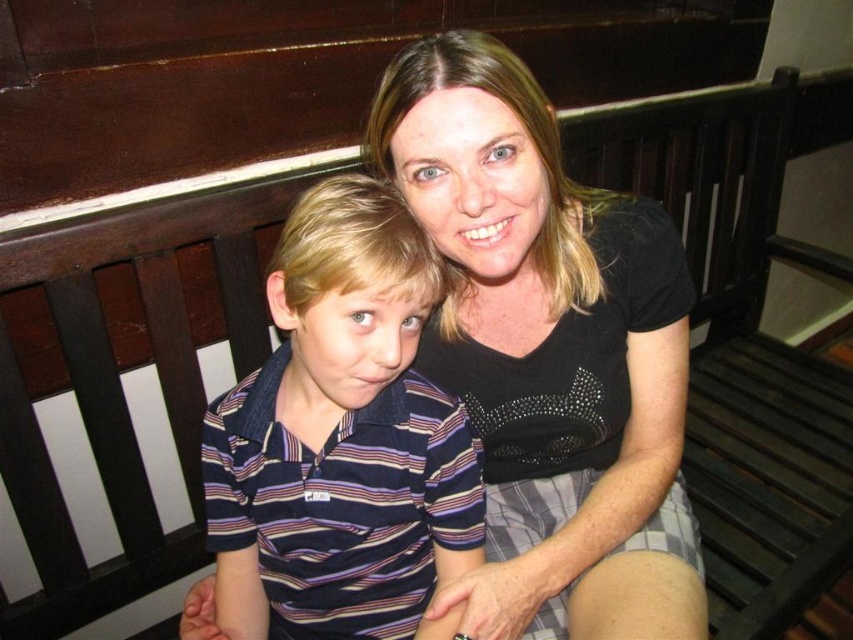
Question: Is black matte shirt at upper center bigger than striped cotton shirt at left?

Choices:
 (A) yes
 (B) no

Answer: (A)

Question: Which object is farther from the camera taking this photo?

Choices:
 (A) black matte shirt at upper center
 (B) striped cotton shirt at left

Answer: (A)

Question: Does black matte shirt at upper center appear over striped cotton shirt at left?

Choices:
 (A) yes
 (B) no

Answer: (A)

Question: In this image, where is black matte shirt at upper center located relative to striped cotton shirt at left?

Choices:
 (A) above
 (B) below

Answer: (A)